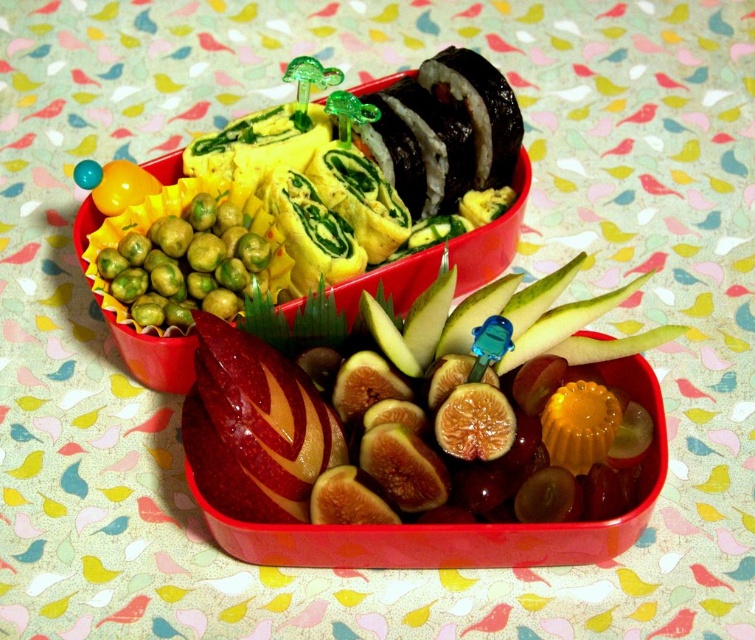
Can you confirm if shiny red apple at center is wider than green matte peas at upper left?

Correct, the width of shiny red apple at center exceeds that of green matte peas at upper left.

Is point (381, 467) less distant than point (119, 253)?

Yes, it is in front of point (119, 253).

What do you see at coordinates (418, 412) in the screenshot?
I see `shiny red apple at center` at bounding box center [418, 412].

At what (x,y) coordinates should I click in order to perform the action: click on shiny red apple at center. Please return your answer as a coordinate pair (x, y). The height and width of the screenshot is (640, 755). Looking at the image, I should click on (418, 412).